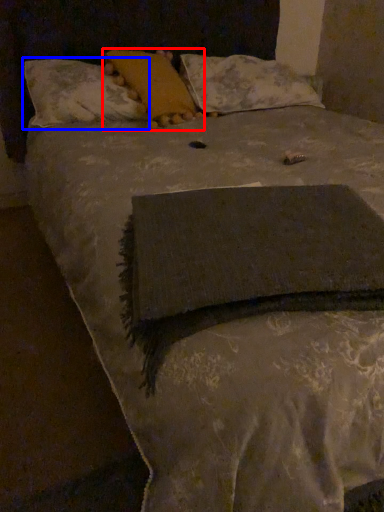
Question: Which point is closer to the camera, pillow (highlighted by a red box) or pillow (highlighted by a blue box)?

Choices:
 (A) pillow
 (B) pillow

Answer: (B)